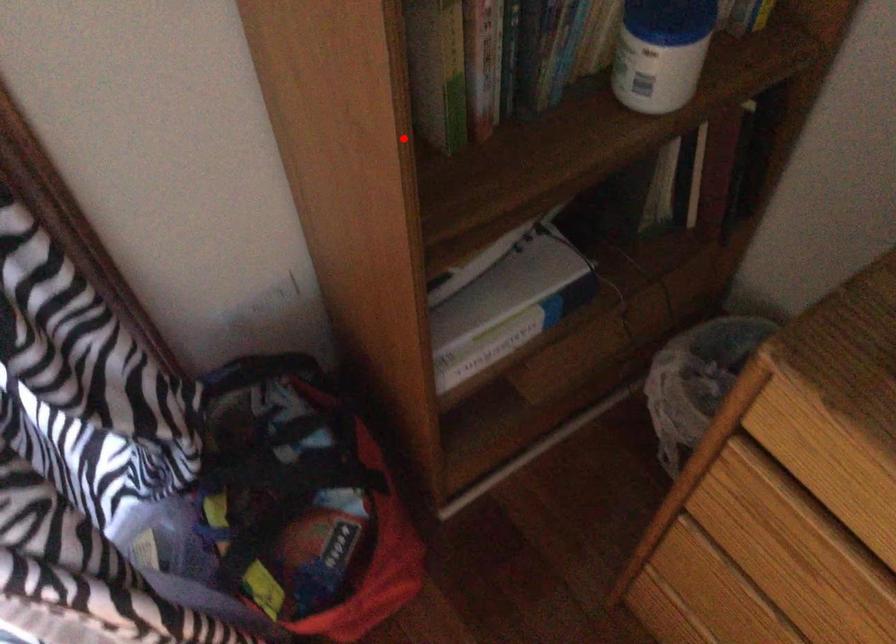
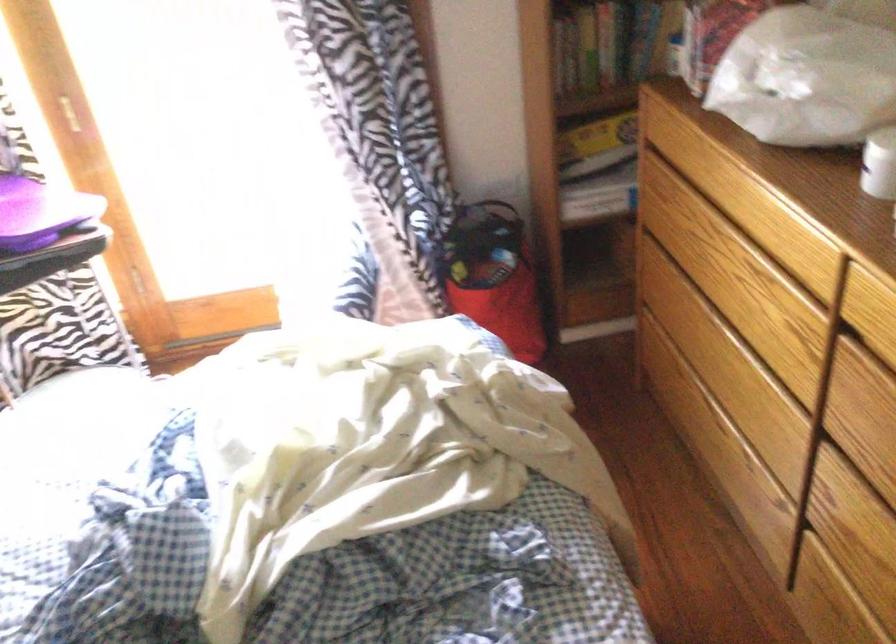
Question: I am providing you with two images of the same scene from different viewpoints. A red point is shown in image1. For the corresponding object point in image2, is it positioned nearer or farther from the camera?

Choices:
 (A) Nearer
 (B) Farther

Answer: (B)